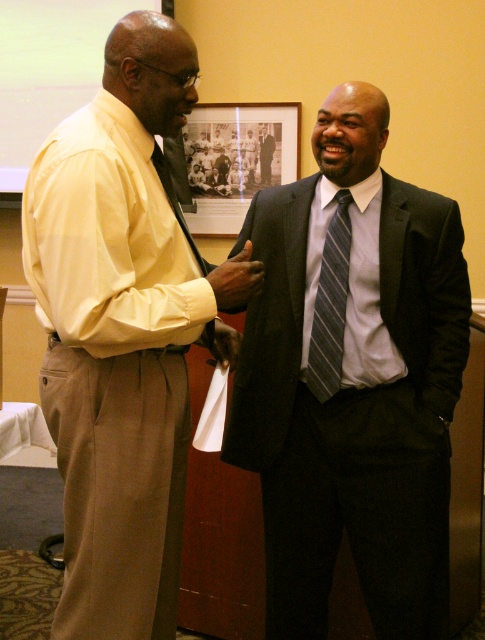
Who is lower down, matte black suit at center or dark gray suit at center?

Positioned lower is matte black suit at center.

Is point (303, 337) positioned in front of point (263, 145)?

Yes, it is.

Does point (420, 525) lie in front of point (271, 157)?

Yes, it is in front of point (271, 157).

Locate an element on the screen. matte black suit at center is located at coordinates (353, 380).

Consider the image. Between matte yellow shirt at left and light blue cotton dress shirt at center, which one is positioned higher?

light blue cotton dress shirt at center is above.

Is point (210, 285) farther from camera compared to point (319, 182)?

That is False.

Identify the location of matte yellow shirt at left. tap(118, 332).

Between matte yellow shirt at left and striped fabric tie at center, which one appears on the right side from the viewer's perspective?

striped fabric tie at center

Is matte yellow shirt at left wider than striped fabric tie at center?

Correct, the width of matte yellow shirt at left exceeds that of striped fabric tie at center.

Describe the element at coordinates (118, 332) in the screenshot. I see `matte yellow shirt at left` at that location.

The width and height of the screenshot is (485, 640). I want to click on matte yellow shirt at left, so click(x=118, y=332).